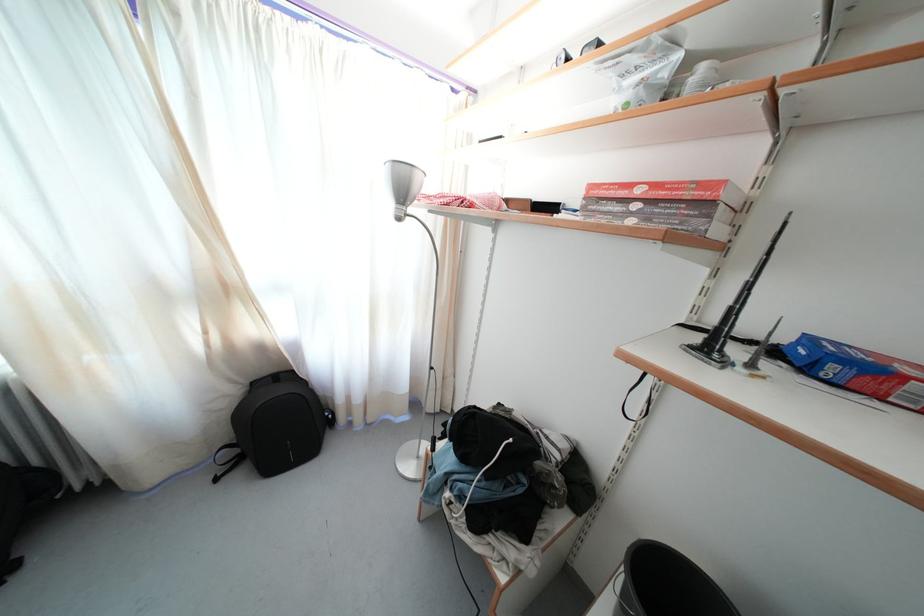
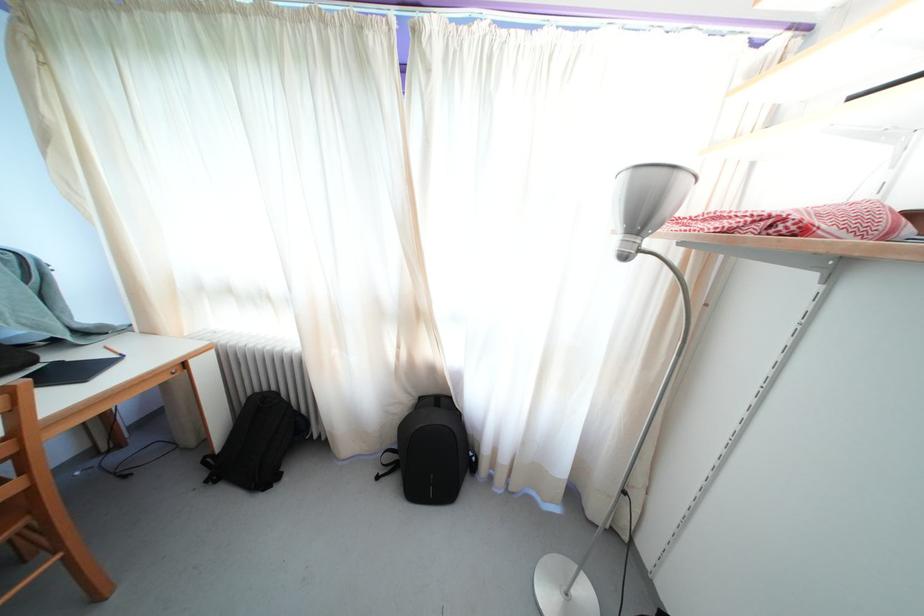
Question: The images are taken continuously from a first-person perspective. In which direction is your viewpoint rotating?

Choices:
 (A) Left
 (B) Right
 (C) Up
 (D) Down

Answer: (A)